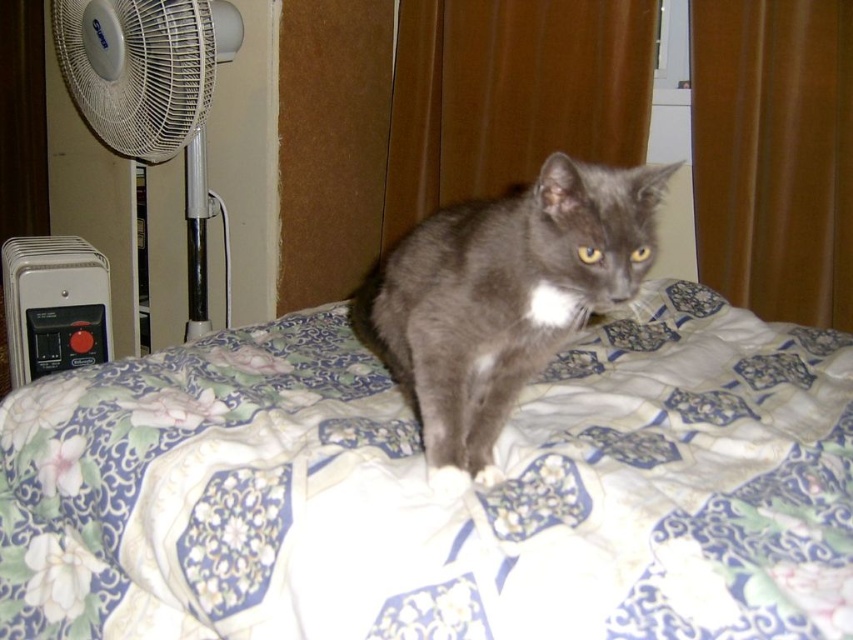
Question: Which object is closer to the camera taking this photo?

Choices:
 (A) floral-patterned fabric at center
 (B) black plastic thermostat at lower left
 (C) gray matte fur cat at center
 (D) white plastic fan at left

Answer: (A)

Question: Which point appears closest to the camera in this image?

Choices:
 (A) (73, 58)
 (B) (453, 435)
 (C) (210, 554)
 (D) (102, 326)

Answer: (C)

Question: Can you confirm if white plastic fan at left is wider than white plastic radiator at lower left?

Choices:
 (A) no
 (B) yes

Answer: (B)

Question: Does white plastic radiator at lower left appear on the right side of black plastic thermostat at lower left?

Choices:
 (A) no
 (B) yes

Answer: (A)

Question: Does white plastic fan at left come in front of black plastic thermostat at lower left?

Choices:
 (A) yes
 (B) no

Answer: (A)

Question: Based on their relative distances, which object is nearer to the gray matte fur cat at center?

Choices:
 (A) white plastic fan at left
 (B) floral-patterned fabric at center

Answer: (B)